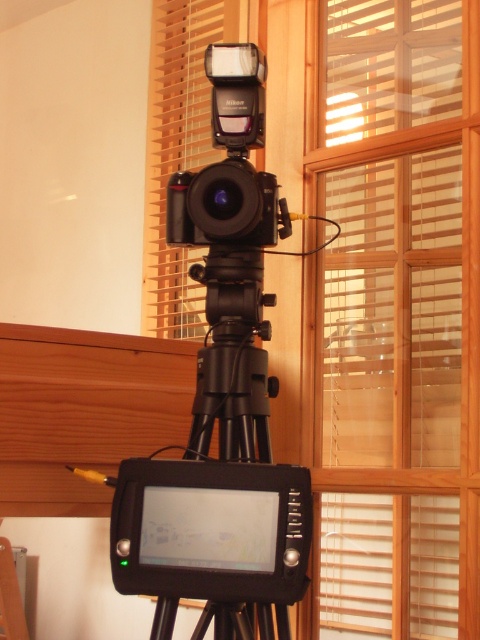
You are setting up a photo shoot in the room described. The wooden blinds at center and the black matte camera at center are part of the setup. You need to ensure that the distance between them is at least 20 inches for proper lighting. Is the current distance sufficient?

The wooden blinds at center is 19.00 inches away from black matte camera at center, which is less than the required 20 inches. Therefore, the current distance is not sufficient for proper lighting.

You are a photographer setting up equipment in a room. You have a wooden blinds at center and a camera. You need to place a 1.5 meter long extension cable between them. Will the cable be long enough?

The wooden blinds at center and camera are 1.67 meters apart. The extension cable is 1.5 meters long, which is shorter than the distance between them. Therefore, the cable will not be long enough.